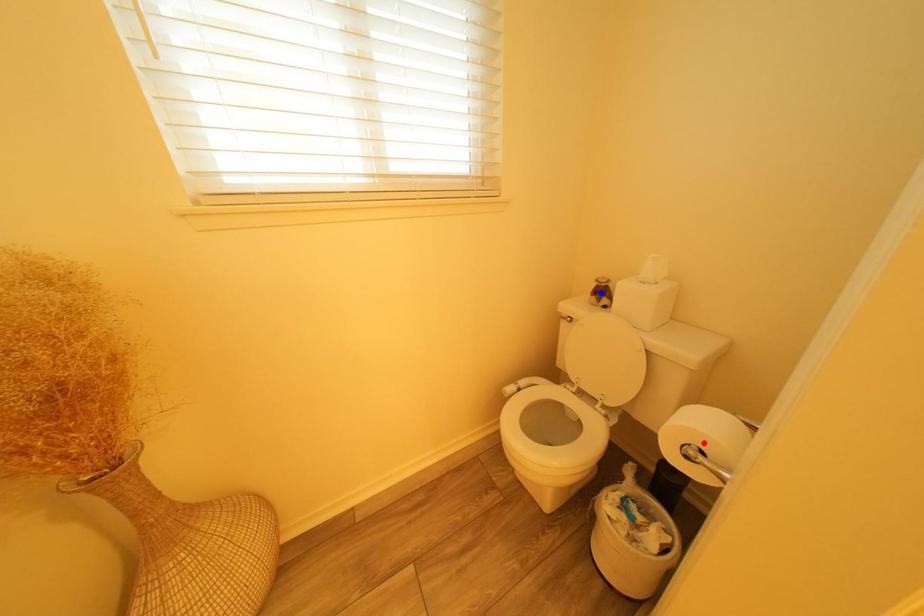
Question: Which of the two points in the image is closer to the camera?

Choices:
 (A) Blue point is closer.
 (B) Red point is closer.

Answer: (B)